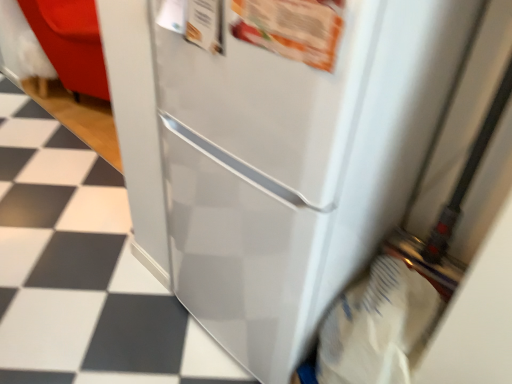
Question: Could you tell me if white paper grocery bag at lower right is facing white glossy tile at lower left, the first tile positioned from the right?

Choices:
 (A) no
 (B) yes

Answer: (A)

Question: Is white paper grocery bag at lower right not inside white glossy tile at lower left, the second tile positioned from the back?

Choices:
 (A) no
 (B) yes

Answer: (B)

Question: From the image's perspective, is white paper grocery bag at lower right on white glossy tile at lower left, arranged as the 2th tile when viewed from the left?

Choices:
 (A) no
 (B) yes

Answer: (A)

Question: From the image's perspective, is white paper grocery bag at lower right located beneath white glossy tile at lower left, the second tile positioned from the back?

Choices:
 (A) no
 (B) yes

Answer: (B)

Question: Are white paper grocery bag at lower right and white glossy tile at lower left, which ranks as the first tile in front-to-back order, located far from each other?

Choices:
 (A) yes
 (B) no

Answer: (B)

Question: Is white paper grocery bag at lower right wider than white glossy tile at lower left, the 1th tile in the bottom-to-top sequence?

Choices:
 (A) no
 (B) yes

Answer: (B)

Question: Is white glossy tile at lower left, acting as the 2th tile starting from the top, far away from white glossy tile at lower left, the 2th tile viewed from the front?

Choices:
 (A) no
 (B) yes

Answer: (B)

Question: Is white glossy tile at lower left, the second tile positioned from the back, bigger than white glossy tile at lower left, the 2th tile viewed from the front?

Choices:
 (A) yes
 (B) no

Answer: (B)

Question: Is white glossy tile at lower left, the 1th tile in the bottom-to-top sequence, at the right side of white glossy tile at lower left, positioned as the 2th tile in right-to-left order?

Choices:
 (A) yes
 (B) no

Answer: (A)

Question: Does white glossy tile at lower left, the 1th tile in the bottom-to-top sequence, have a smaller size compared to white glossy tile at lower left, positioned as the 2th tile in right-to-left order?

Choices:
 (A) no
 (B) yes

Answer: (B)

Question: Is white glossy tile at lower left, acting as the 2th tile starting from the top, located outside white glossy tile at lower left, positioned as the 2th tile in right-to-left order?

Choices:
 (A) yes
 (B) no

Answer: (A)

Question: Is white glossy tile at lower left, arranged as the 1th tile when viewed from the back, at the back of white glossy tile at lower left, acting as the 2th tile starting from the top?

Choices:
 (A) no
 (B) yes

Answer: (A)

Question: Is white glossy tile at lower left, the second tile positioned from the back, wider than white paper grocery bag at lower right?

Choices:
 (A) yes
 (B) no

Answer: (B)